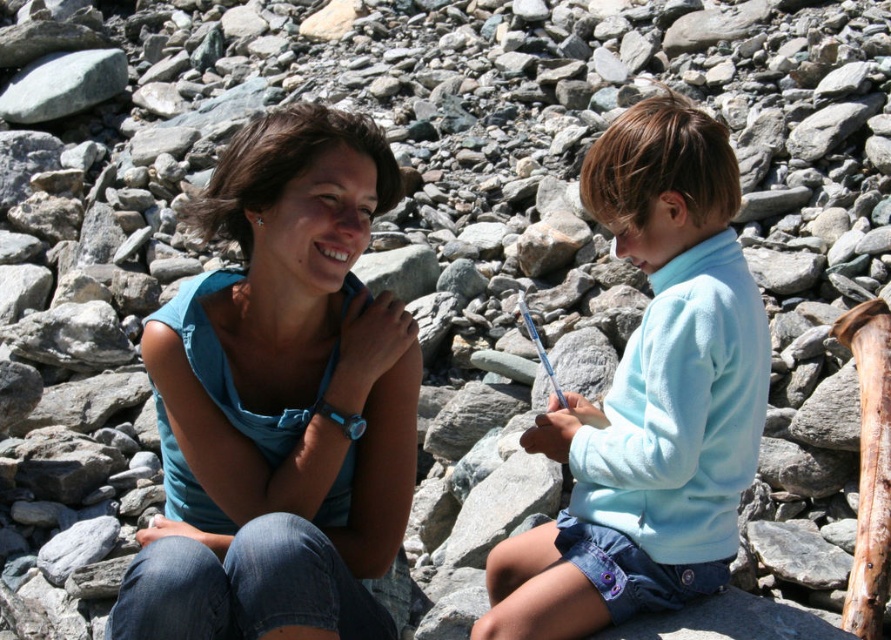
Question: Which of the following is the closest to the observer?

Choices:
 (A) (565, 570)
 (B) (202, 280)

Answer: (A)

Question: Among these objects, which one is farthest from the camera?

Choices:
 (A) blue denim jeans at center
 (B) light blue fleece at center

Answer: (B)

Question: Is blue denim jeans at center above light blue fleece at center?

Choices:
 (A) no
 (B) yes

Answer: (A)

Question: Which of the following is the closest to the observer?

Choices:
 (A) blue denim jeans at center
 (B) light blue fleece at center

Answer: (A)

Question: Is blue denim jeans at center below light blue fleece at center?

Choices:
 (A) yes
 (B) no

Answer: (A)

Question: Is blue denim jeans at center below light blue fleece at center?

Choices:
 (A) no
 (B) yes

Answer: (B)